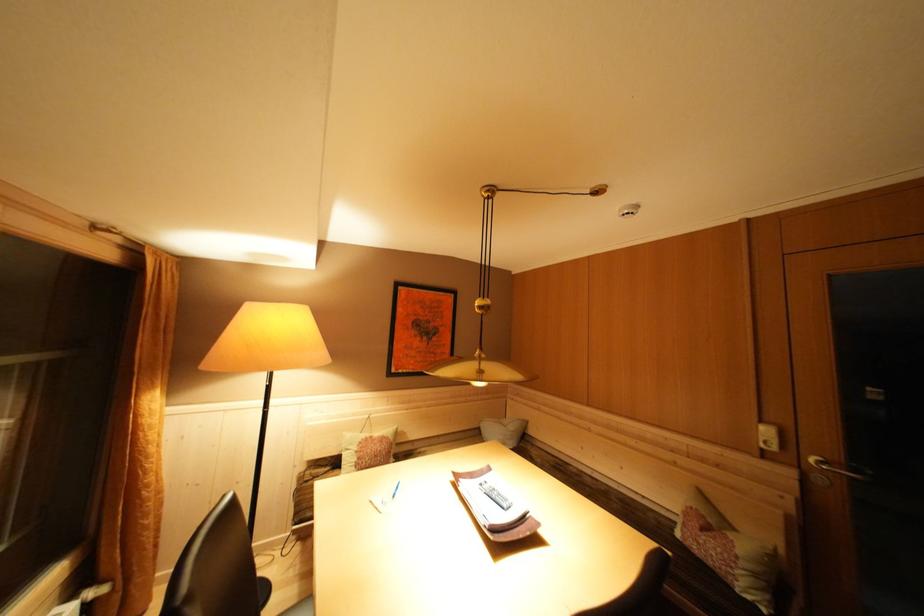
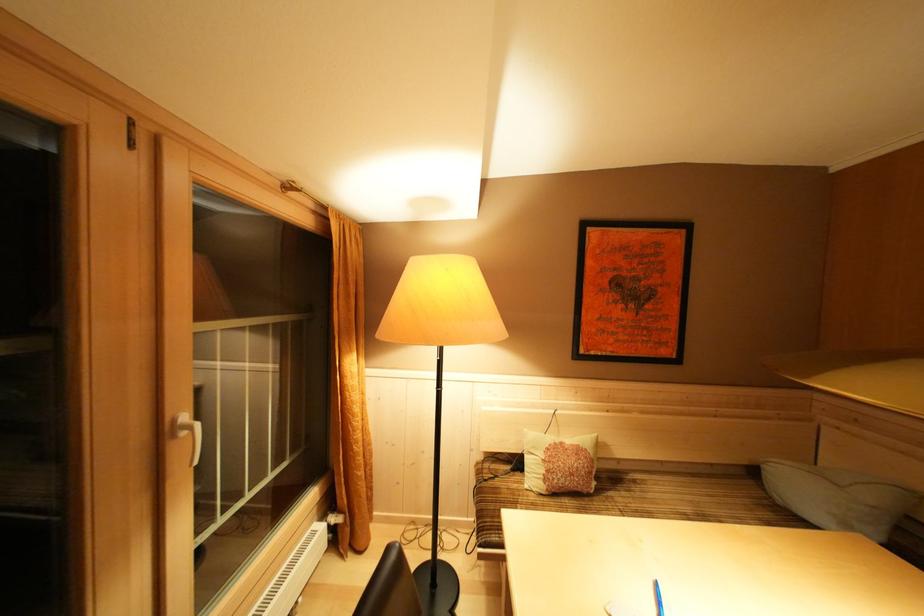
Question: I am providing you with two images of the same scene from different viewpoints. After the viewpoint changes to image2, which objects are now occluded?

Choices:
 (A) decorative square pillow
 (B) orange curtain
 (C) sofa sitting surface
 (D) none of these

Answer: (D)